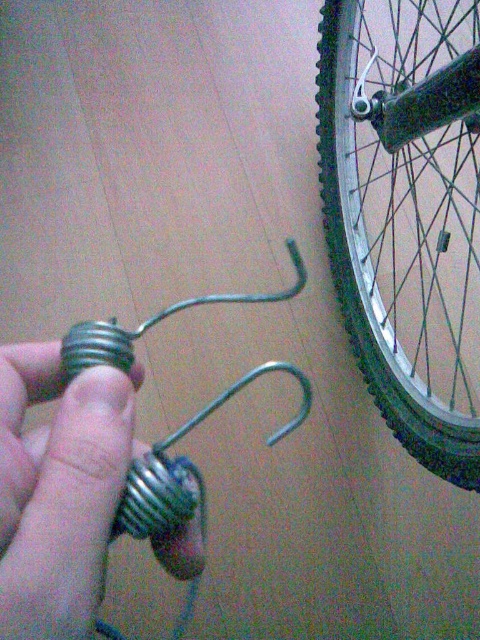
Looking at this image, you are trying to hang a metallic silver wheel at right on the wall using the metallic silver hook at lower left. Based on their sizes, will the wheel fit onto the hook?

The metallic silver wheel at right is larger in size than the metallic silver hook at lower left, so it will not fit onto the hook.

You are trying to hang a metallic silver hook at lower left on the wall behind the metallic silver wheel at right. Can you see the hook once the wheel is placed there?

The metallic silver hook at lower left is behind the metallic silver wheel at right, so the wheel will block the view of the hook once it is placed there.

Based on the photo, you are a painter standing at the center of the room. You want to paint the metallic silver wheel at right which is located at point [407,212]. Can you reach it with your 1.5 meter long brush?

The metallic silver wheel at right is located at point [407,212]. Since the brush is 1.5 meters long, it should be long enough to reach the wheel if the distance from the painter to the wheel is within 1.5 meters. However, without knowing the exact distance between the painter and the wheel, it is impossible to determine if the brush will be sufficient.